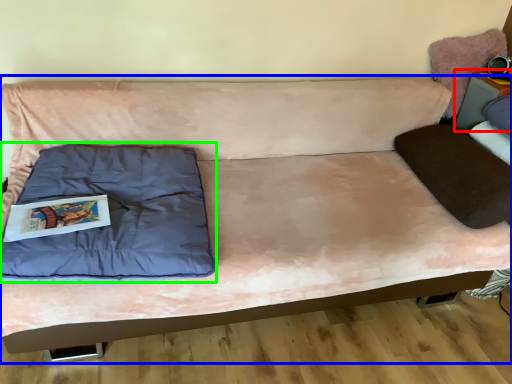
Question: Which object is the farthest from table (highlighted by a red box)? Choose among these: studio couch (highlighted by a blue box) or pillow (highlighted by a green box).

Choices:
 (A) studio couch
 (B) pillow

Answer: (B)